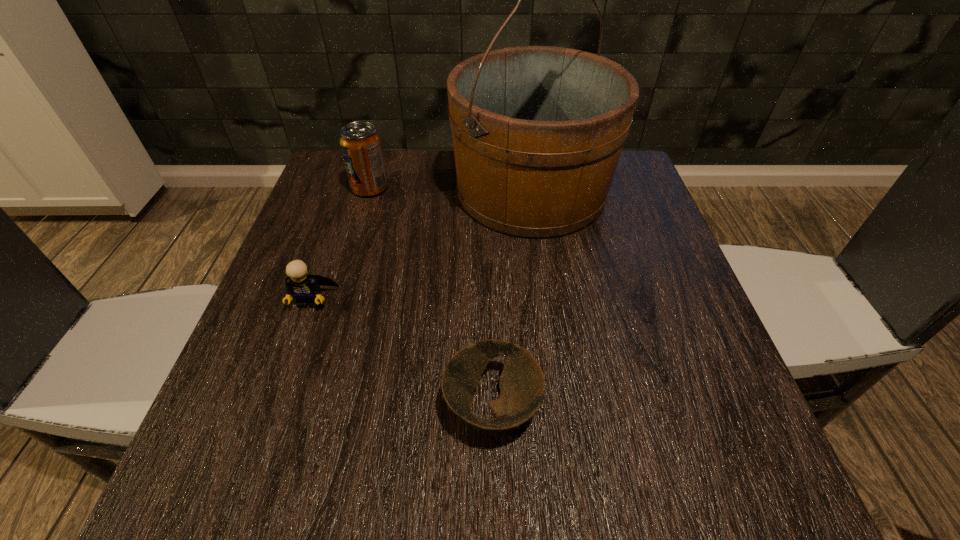
Image resolution: width=960 pixels, height=540 pixels. I want to click on bucket, so (x=538, y=131).

Identify the location of the third shortest object. (361, 145).

Identify the location of Lego. This screenshot has height=540, width=960. (305, 288).

This screenshot has height=540, width=960. I want to click on the second shortest object, so click(305, 288).

Identify the location of the nearest object. (522, 385).

Image resolution: width=960 pixels, height=540 pixels. What are the coordinates of `bowl` in the screenshot? It's located at (522, 385).

This screenshot has height=540, width=960. What are the coordinates of `free spot located 0.090m on the front of the bucket` in the screenshot? It's located at (542, 274).

The image size is (960, 540). What are the coordinates of `blank space located 0.170m on the right of the second tallest object` in the screenshot? It's located at (459, 188).

Find the location of a particular element. The width and height of the screenshot is (960, 540). free space located on the front-facing side of the Lego is located at coordinates [x=246, y=487].

At what (x,y) coordinates should I click in order to perform the action: click on vacant space located on the back of the bowl. Please return your answer as a coordinate pair (x, y). The height and width of the screenshot is (540, 960). Looking at the image, I should click on (490, 289).